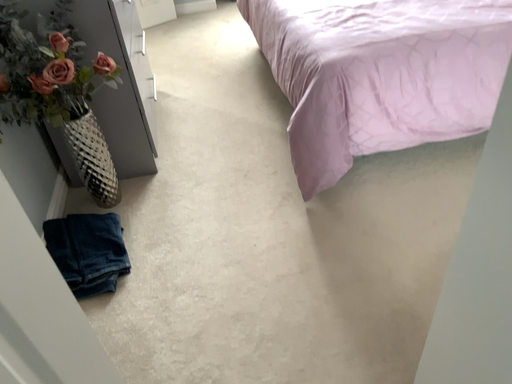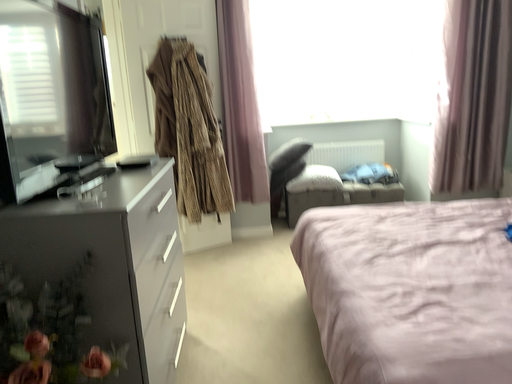
Question: How did the camera likely rotate when shooting the video?

Choices:
 (A) rotated downward
 (B) rotated upward

Answer: (B)